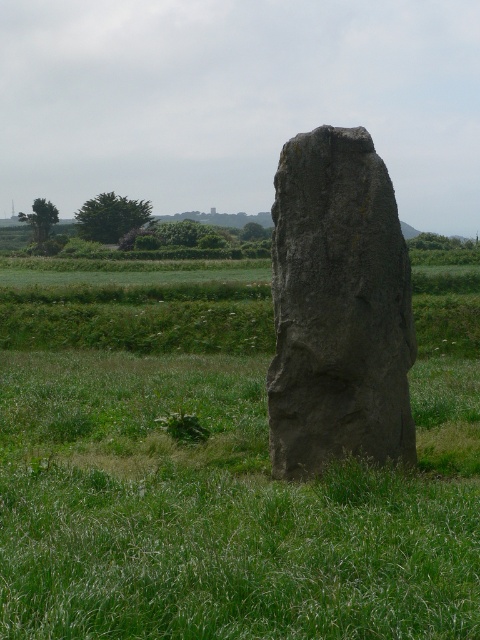
You are standing at the origin point in the field. The gray stone monolith at center is at coordinates 0.730, 0.454. If you want to walk directly towards it, which direction should you head?

The gray stone monolith at center is located at coordinates (217, 467), so you should head northeast to reach it.

You are an archaeologist examining the gray stone monolith at center and the gray rough stone at center in the image. Which object would require more effort to move due to its size?

The gray stone monolith at center requires more effort to move because it has a larger size compared to the gray rough stone at center.

You are a geologist examining two gray stones in the image. The scene shows a gray stone monolith at center and a gray rough stone at center. Which of these two stones is wider?

The gray stone monolith at center might be wider than gray rough stone at center according to the description provided.